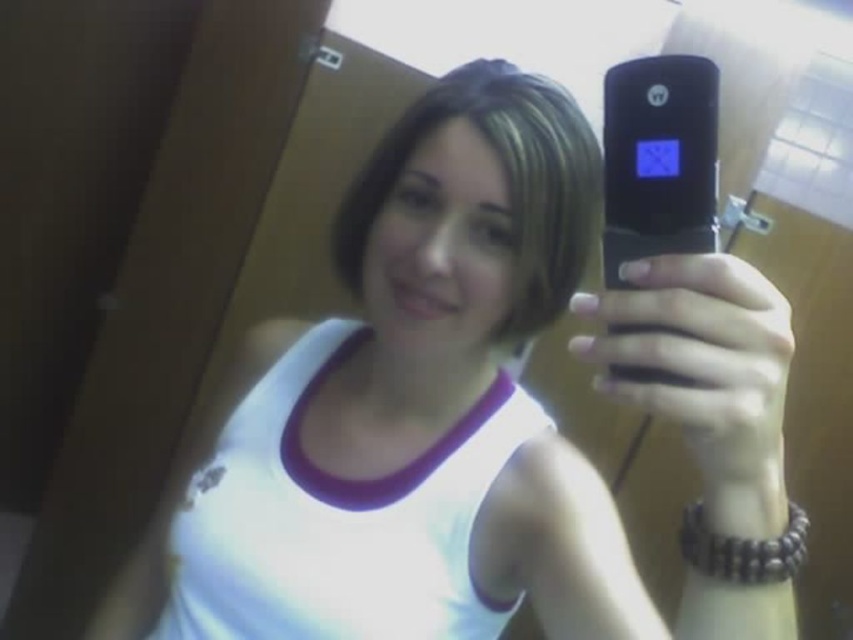
Does matte black phone at center appear under black matte smartphone at center?

Yes, matte black phone at center is below black matte smartphone at center.

Does matte black phone at center have a greater height compared to black matte smartphone at center?

No, matte black phone at center is not taller than black matte smartphone at center.

Identify the location of matte black phone at center. This screenshot has width=853, height=640. (700, 355).